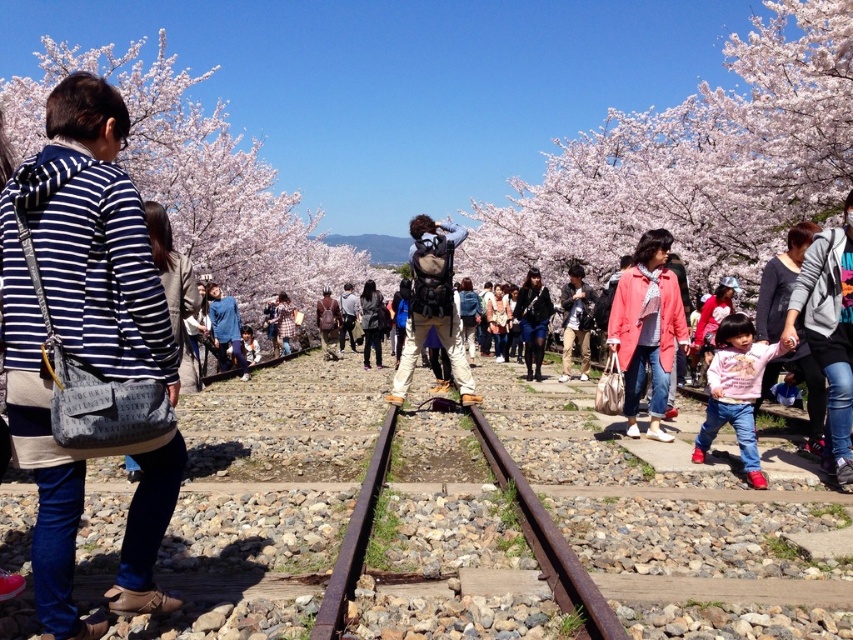
At what (x,y) coordinates should I click in order to perform the action: click on white blossoms at center. Please return your answer as a coordinate pair (x, y). Image resolution: width=853 pixels, height=640 pixels. Looking at the image, I should click on (695, 163).

Between white blossoms at center and black leather jacket at center, which one has less height?

black leather jacket at center

Between point (473, 218) and point (543, 298), which one is positioned in front?

Point (543, 298) is in front.

This screenshot has width=853, height=640. Find the location of `white blossoms at center`. white blossoms at center is located at coordinates (695, 163).

Is pink fleece jacket at lower right wider than pink fabric jacket at center?

Yes.

Does pink fleece jacket at lower right have a lesser height compared to pink fabric jacket at center?

Incorrect, pink fleece jacket at lower right's height does not fall short of pink fabric jacket at center's.

The width and height of the screenshot is (853, 640). What do you see at coordinates (735, 390) in the screenshot?
I see `pink fleece jacket at lower right` at bounding box center [735, 390].

The width and height of the screenshot is (853, 640). What are the coordinates of `pink fleece jacket at lower right` in the screenshot? It's located at (735, 390).

This screenshot has height=640, width=853. Describe the element at coordinates (86, 342) in the screenshot. I see `striped cotton hoodie at left` at that location.

Can you confirm if striped cotton hoodie at left is shorter than pink fleece jacket at lower right?

In fact, striped cotton hoodie at left may be taller than pink fleece jacket at lower right.

This screenshot has height=640, width=853. What do you see at coordinates (86, 342) in the screenshot?
I see `striped cotton hoodie at left` at bounding box center [86, 342].

This screenshot has height=640, width=853. In order to click on striped cotton hoodie at left in this screenshot , I will do `click(86, 342)`.